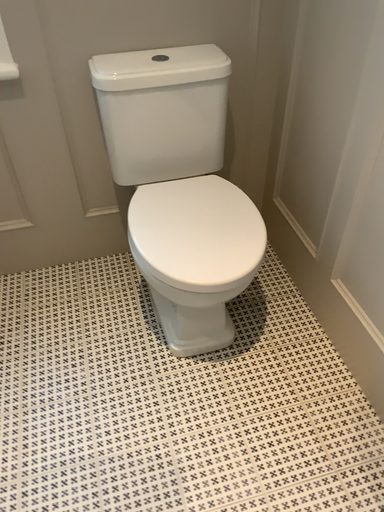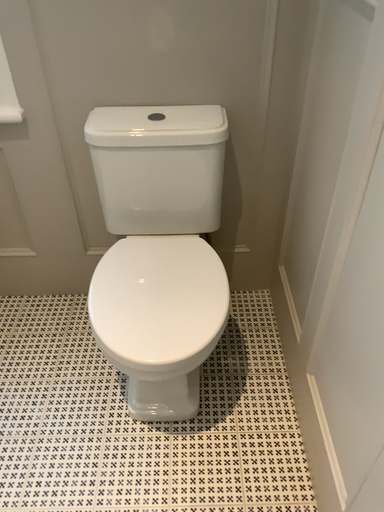
Question: How did the camera likely rotate when shooting the video?

Choices:
 (A) rotated right
 (B) rotated left

Answer: (B)